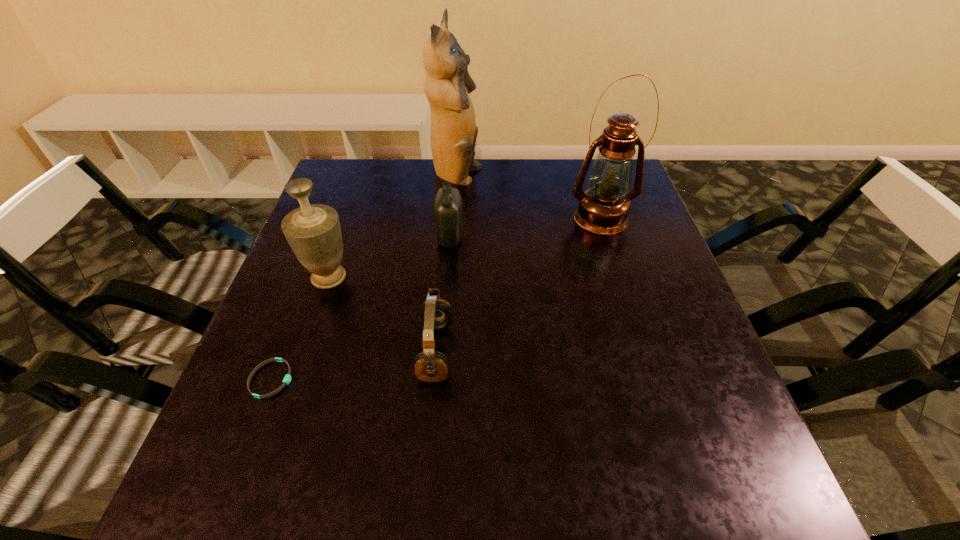
You are a GUI agent. You are given a task and a screenshot of the screen. Output one action in this format:
    pyautogui.click(x=<x>, y=<y>)
    Task: Click on the blank area located on the back of the third tallest object
    The height and width of the screenshot is (540, 960).
    Given the screenshot: What is the action you would take?
    tap(354, 204)

Locate an element on the screen. The width and height of the screenshot is (960, 540). vacant space situated on the back of the bottle is located at coordinates (453, 199).

This screenshot has width=960, height=540. I want to click on free region located on the ear cups of the fifth tallest object, so click(641, 352).

This screenshot has height=540, width=960. I want to click on free space located 0.070m on the buckle of the shortest object, so click(330, 379).

Find the location of a particular element. The image size is (960, 540). cat that is at the far edge is located at coordinates (453, 133).

The height and width of the screenshot is (540, 960). I want to click on oil lamp present at the far edge, so click(x=603, y=208).

You are a GUI agent. You are given a task and a screenshot of the screen. Output one action in this format:
    pyautogui.click(x=<x>, y=<y>)
    Task: Click on the urn that is at the left edge
    The height and width of the screenshot is (540, 960).
    Given the screenshot: What is the action you would take?
    pyautogui.click(x=313, y=231)

At what (x,y) coordinates should I click in order to perform the action: click on wristband at the left edge. Please return your answer as a coordinate pair (x, y). This screenshot has height=540, width=960. Looking at the image, I should click on (287, 378).

Locate an element on the screen. This screenshot has height=540, width=960. object that is at the right edge is located at coordinates (603, 208).

Find the location of a particular element. This screenshot has width=960, height=540. object present at the far right corner is located at coordinates (603, 208).